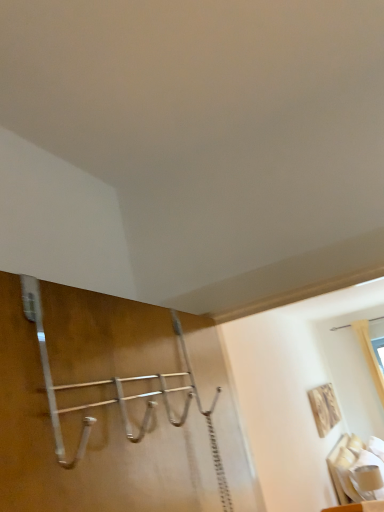
This screenshot has width=384, height=512. What are the coordinates of `metallic silver hooks at upper left` in the screenshot? It's located at (98, 408).

What do you see at coordinates (98, 408) in the screenshot? I see `metallic silver hooks at upper left` at bounding box center [98, 408].

Find the location of `metallic silver hooks at upper left`. metallic silver hooks at upper left is located at coordinates (98, 408).